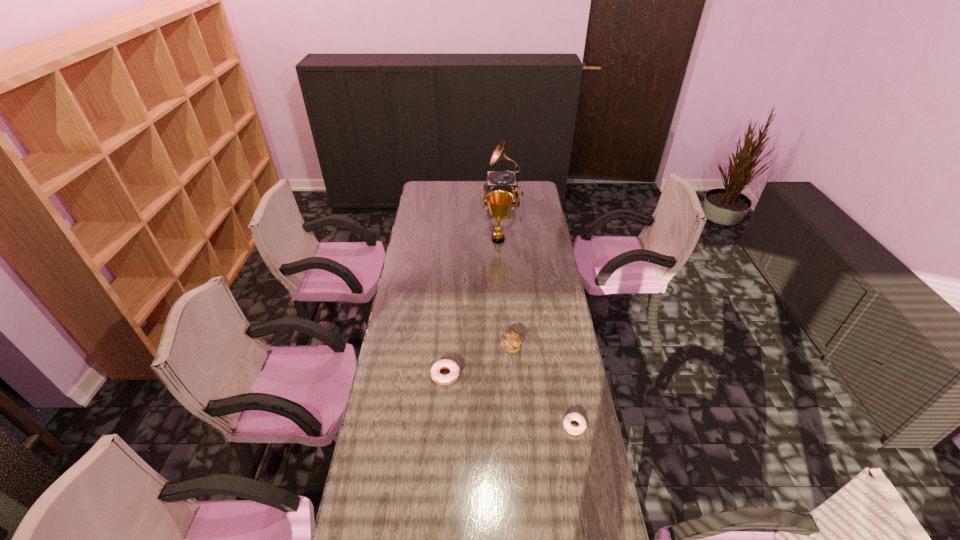
At what (x,y) coordinates should I click in order to perform the action: click on vacant space that satisfies the following two spatial constraints: 1. on the front view with handles of the third nearest object; 2. on the right side of the award. Please return your answer as a coordinate pair (x, y). The height and width of the screenshot is (540, 960). Looking at the image, I should click on (504, 347).

Where is `vacant point that satisfies the following two spatial constraints: 1. on the horn of the farthest object; 2. on the front side of the fourth farthest object`? This screenshot has width=960, height=540. vacant point that satisfies the following two spatial constraints: 1. on the horn of the farthest object; 2. on the front side of the fourth farthest object is located at coordinates (516, 375).

The image size is (960, 540). What are the coordinates of `vacant region that satisfies the following two spatial constraints: 1. on the horn of the record player; 2. on the front side of the farther doughnut` in the screenshot? It's located at (516, 375).

I want to click on free spot that satisfies the following two spatial constraints: 1. on the front view with handles of the award; 2. on the right side of the rightmost object, so click(x=508, y=426).

What are the coordinates of `free space in the image that satisfies the following two spatial constraints: 1. on the front view with handles of the shorter doughnut; 2. on the left side of the second farthest object` in the screenshot? It's located at (508, 426).